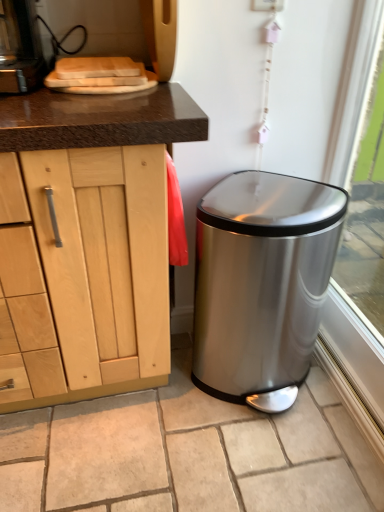
Question: From the image's perspective, is satin silver trash can at lower right above or below polished stainless steel trash can at lower right?

Choices:
 (A) below
 (B) above

Answer: (A)

Question: Is satin silver trash can at lower right to the left or to the right of polished stainless steel trash can at lower right in the image?

Choices:
 (A) left
 (B) right

Answer: (A)

Question: Considering the real-world distances, which object is closest to the satin silver trash can at lower right?

Choices:
 (A) polished stainless steel trash can at lower right
 (B) transparent glass window at lower right

Answer: (A)

Question: Which object is the closest to the polished stainless steel trash can at lower right?

Choices:
 (A) satin silver trash can at lower right
 (B) transparent glass window at lower right

Answer: (A)